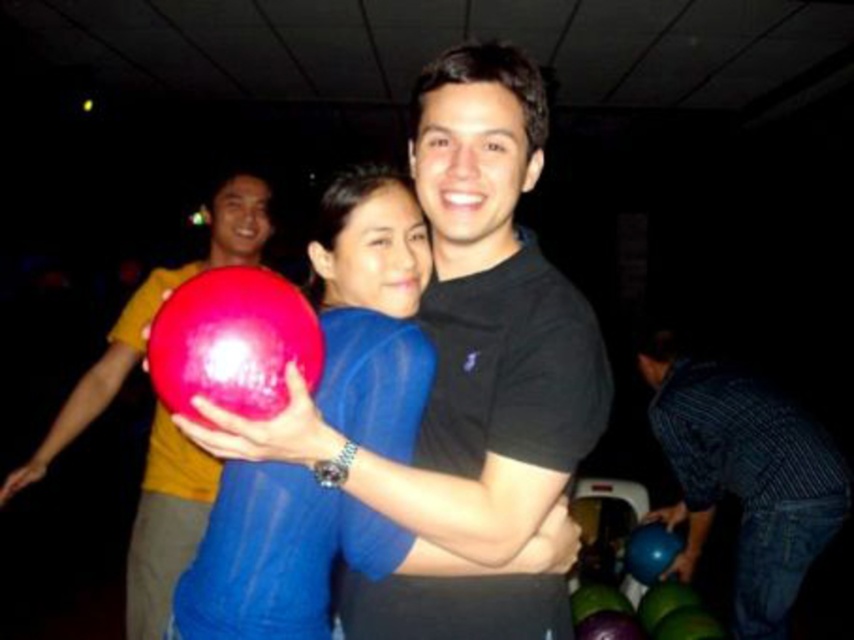
Question: Does matte plastic bowling ball at center lie behind blue striped shirt at lower right?

Choices:
 (A) no
 (B) yes

Answer: (A)

Question: Which object is farther from the camera taking this photo?

Choices:
 (A) rubberized red bowling ball at center
 (B) rubberized yellow bowling ball at center
 (C) blue striped shirt at lower right
 (D) matte plastic bowling ball at center

Answer: (C)

Question: Which object is the farthest from the matte plastic bowling ball at center?

Choices:
 (A) blue striped shirt at lower right
 (B) rubberized red bowling ball at center

Answer: (A)

Question: From the image, what is the correct spatial relationship of blue striped shirt at lower right in relation to rubberized red bowling ball at center?

Choices:
 (A) below
 (B) above

Answer: (A)

Question: In this image, where is rubberized yellow bowling ball at center located relative to rubberized red bowling ball at center?

Choices:
 (A) above
 (B) below

Answer: (B)

Question: Which object is closer to the camera taking this photo?

Choices:
 (A) matte plastic bowling ball at center
 (B) rubberized yellow bowling ball at center
 (C) rubberized red bowling ball at center

Answer: (C)